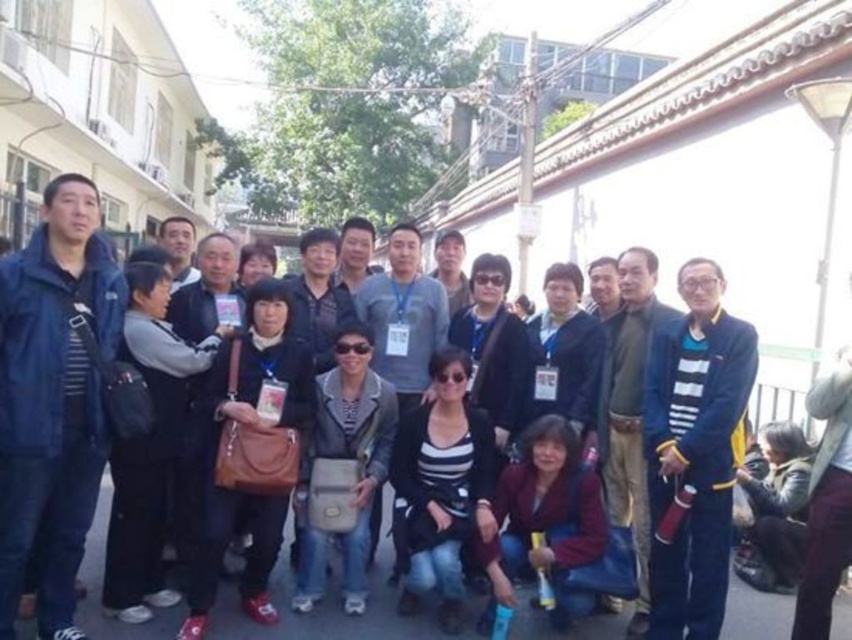
You are standing in the scene and want to move from the point at coordinates point (507, 477) to the point at coordinates point (344, 568). Which direction should you move to get closer to the latter?

Since point (507, 477) is further to the camera than point (344, 568), you should move towards the direction of the camera to reach the latter point.

You are a photographer trying to adjust the composition of the photo. The black striped shirt at center and dark red fabric jacket at lower center are currently 21.51 inches apart. If you want to make them appear closer together in the final image without moving the subjects, what technique could you use?

You can use a wide angle lens to compress the distance between the black striped shirt at center and dark red fabric jacket at lower center, making them appear closer together in the photo.

You are standing at the origin of the coordinate system in the image. You need to walk to point A at point [463,374] and point B at point [358,397]. Which point will you reach first?

Point A at point [463,374] is in front of point B at point [358,397], so you will reach point A first.